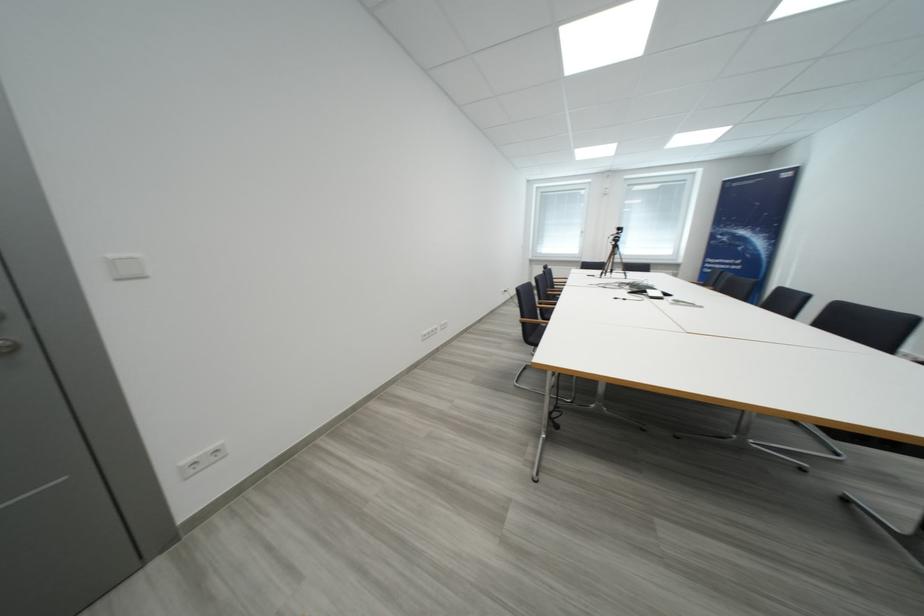
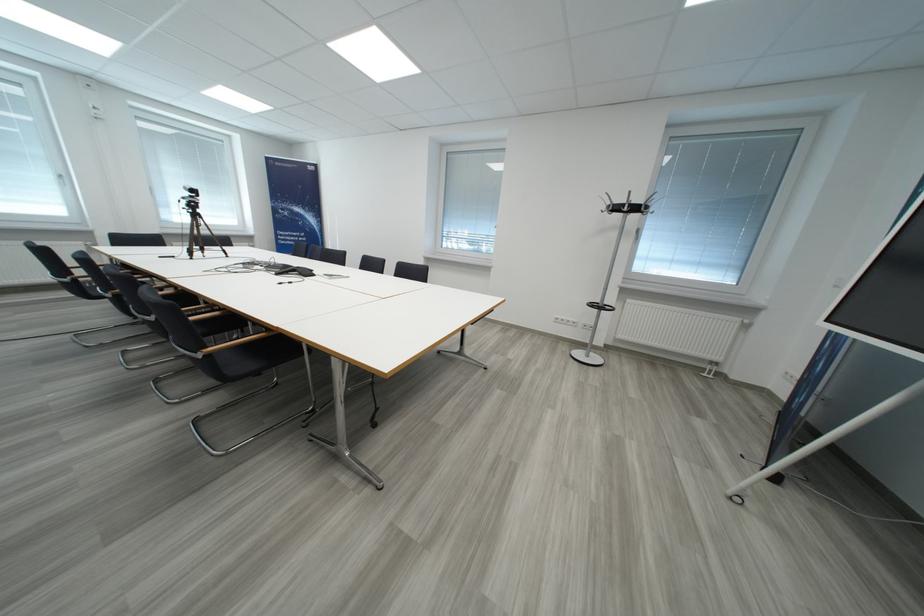
First-person continuous shooting, in which direction is the camera rotating?

The camera's rotation is toward right-down.